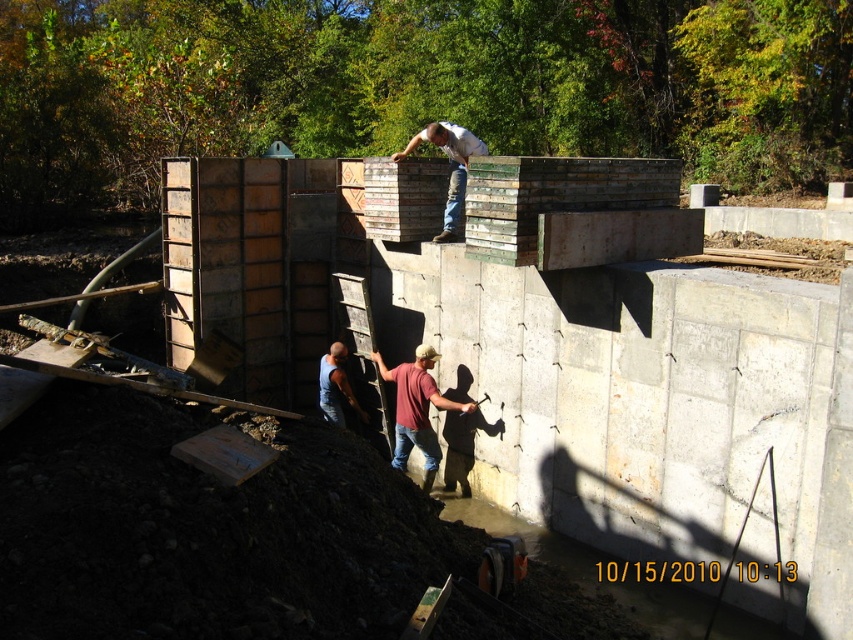
Question: Which of the following is the farthest from the observer?

Choices:
 (A) (323, 376)
 (B) (425, 346)
 (C) (433, 138)

Answer: (A)

Question: Which of the following is the closest to the observer?

Choices:
 (A) (448, 214)
 (B) (332, 412)
 (C) (405, 381)

Answer: (C)

Question: Can you confirm if maroon shirt at lower center is smaller than blue denim jeans at lower center?

Choices:
 (A) no
 (B) yes

Answer: (A)

Question: Which point appears closest to the camera in this image?

Choices:
 (A) (468, 140)
 (B) (363, 413)

Answer: (A)

Question: Is matte concrete block at upper center positioned before blue denim jeans at lower center?

Choices:
 (A) no
 (B) yes

Answer: (B)

Question: Is maroon shirt at lower center bigger than matte concrete block at upper center?

Choices:
 (A) yes
 (B) no

Answer: (B)